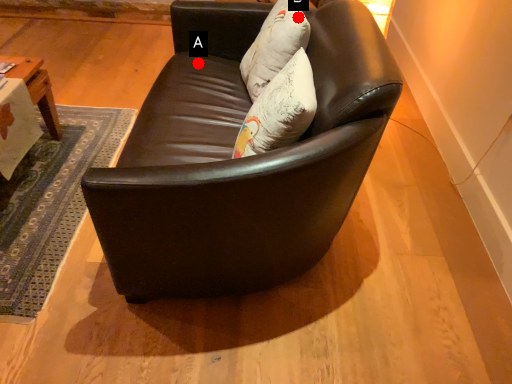
Question: Two points are circled on the image, labeled by A and B beside each circle. Which of the following is the farthest from the observer?

Choices:
 (A) A is further
 (B) B is further

Answer: (A)